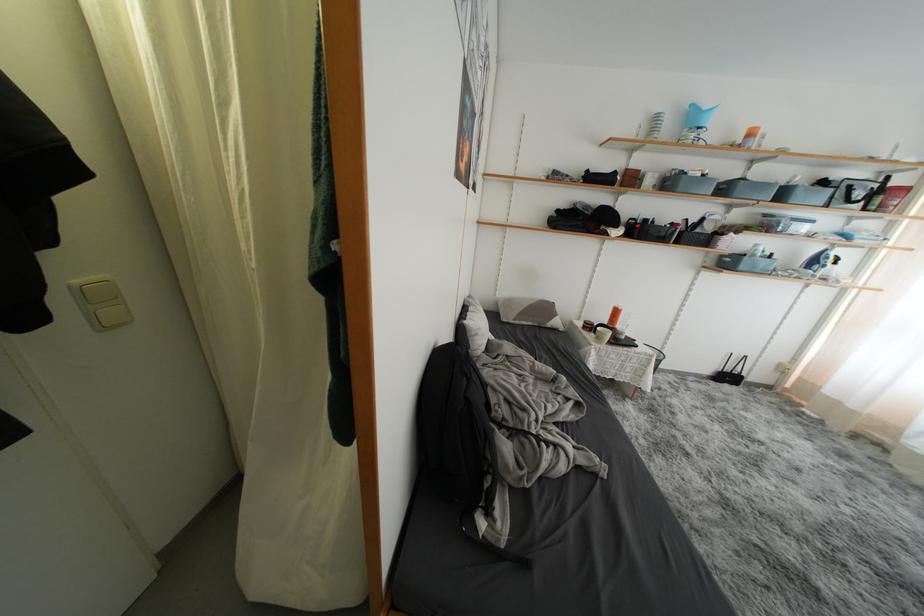
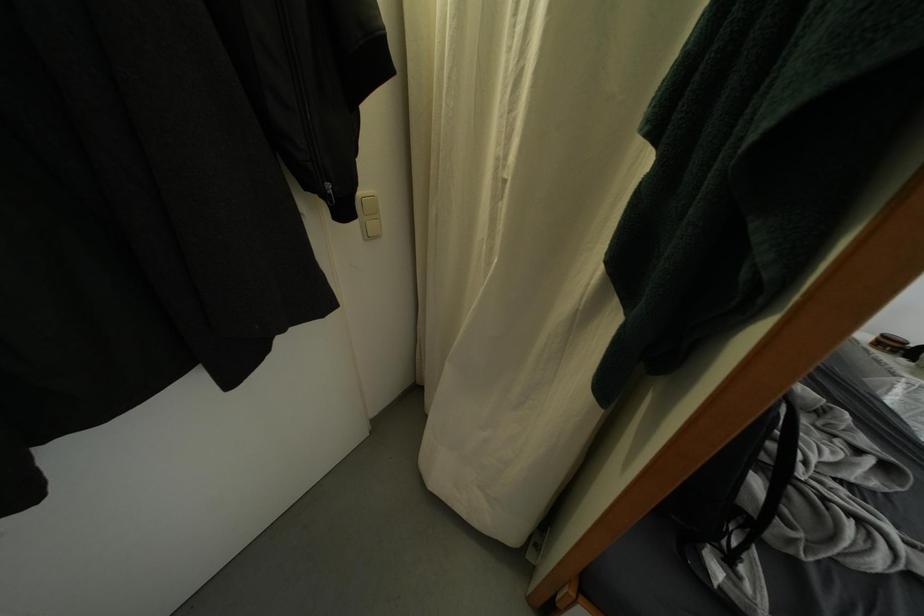
In the second image, find the point that corresponds to (590,331) in the first image.

(884, 347)